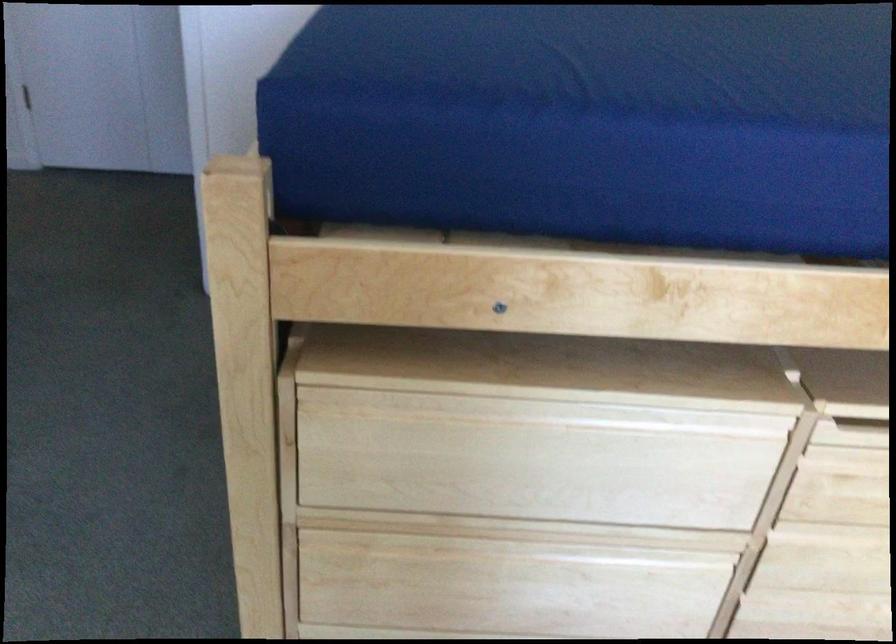
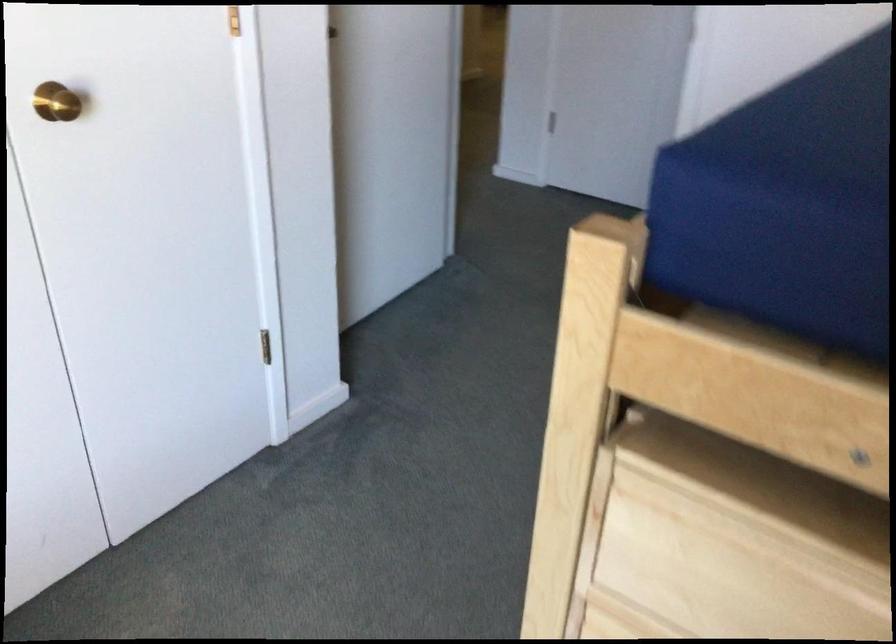
Question: The first image is from the beginning of the video and the second image is from the end. How did the camera likely rotate when shooting the video?

Choices:
 (A) Left
 (B) Right
 (C) Up
 (D) Down

Answer: (A)